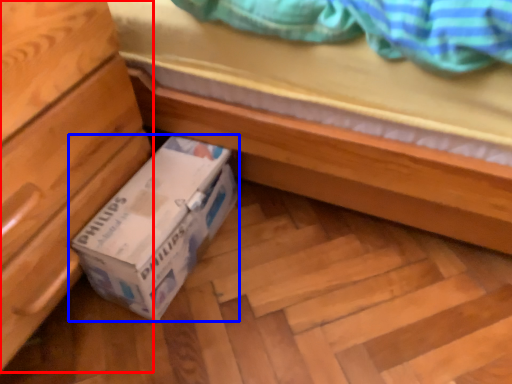
Question: Which of the following is the farthest to the observer, chest of drawers (highlighted by a red box) or box (highlighted by a blue box)?

Choices:
 (A) chest of drawers
 (B) box

Answer: (B)